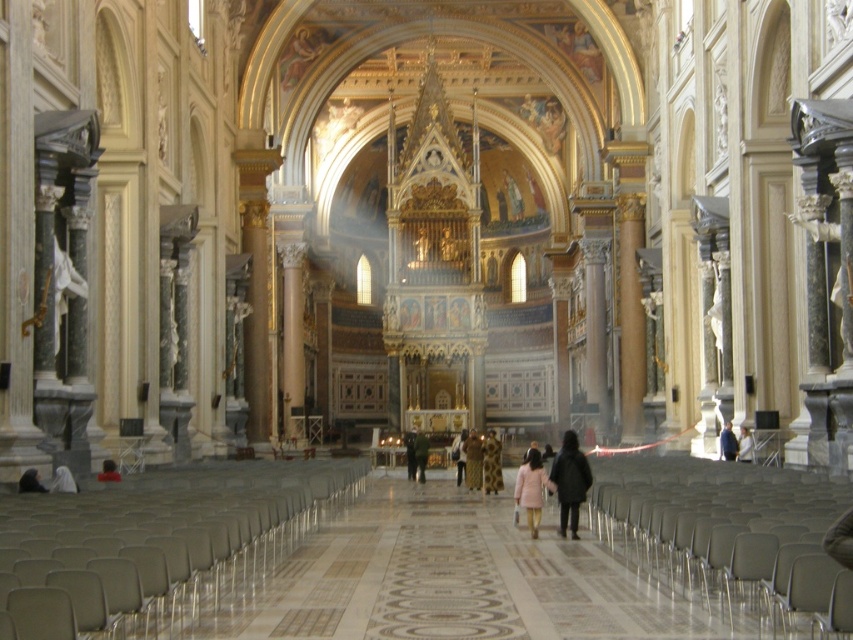
You are a photographer planning to capture a group photo of the two people in the cathedral. The white fabric person at center and the matte black person at lower left are standing in the scene. Considering their sizes, which person should be placed closer to the camera to maintain a balanced composition?

The matte black person at lower left should be placed closer to the camera because the white fabric person at center is wider, so positioning the smaller matte black person at lower left nearer will help balance their sizes in the frame.

You are standing in the cathedral and notice a blue denim jacket at center and a white fabric person at lower left. From your perspective, which object is positioned higher in the image?

The blue denim jacket at center is positioned higher than the white fabric person at lower left.